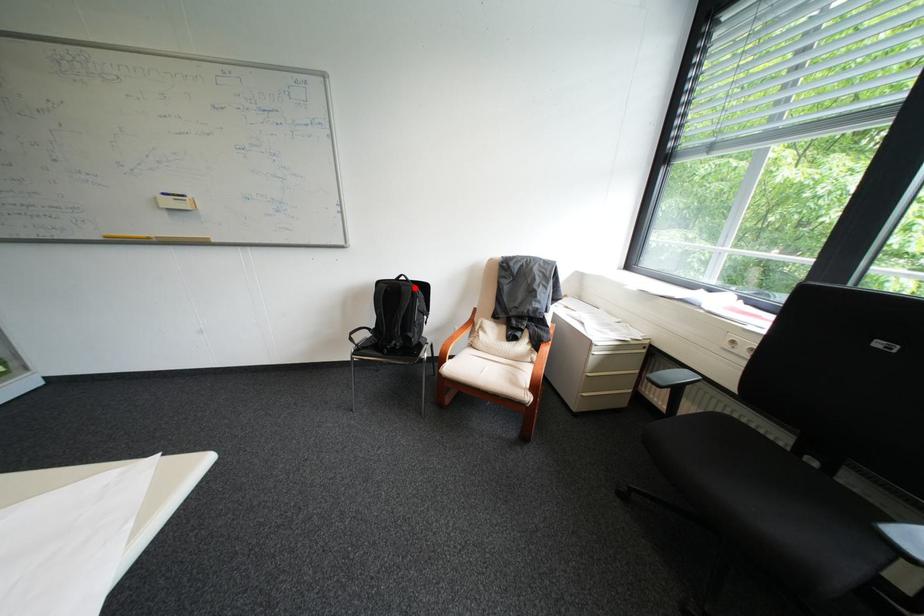
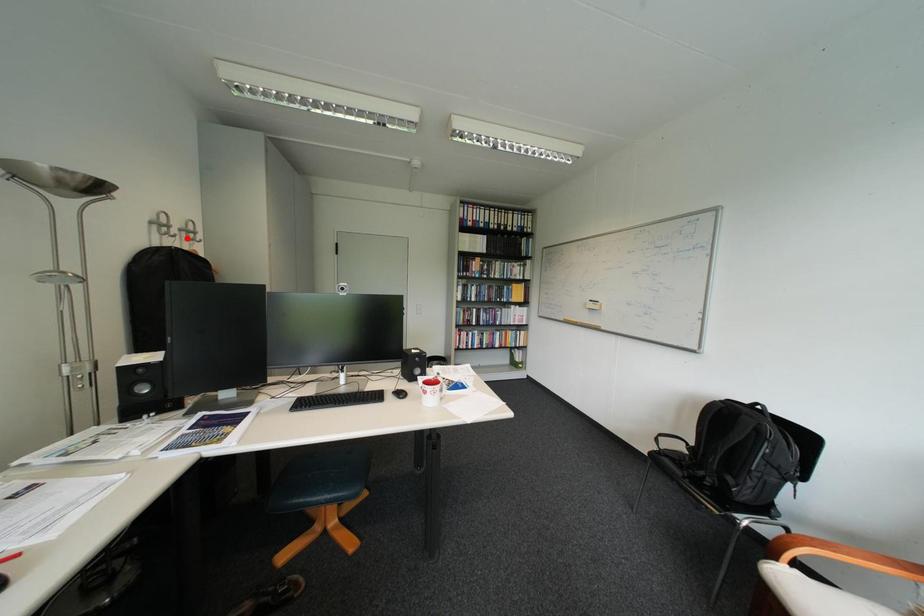
I am providing you with two images of the same scene from different viewpoints. A red point is marked on the first image and another point is marked on the second image. Do the highlighted points in image1 and image2 indicate the same real-world spot?

No